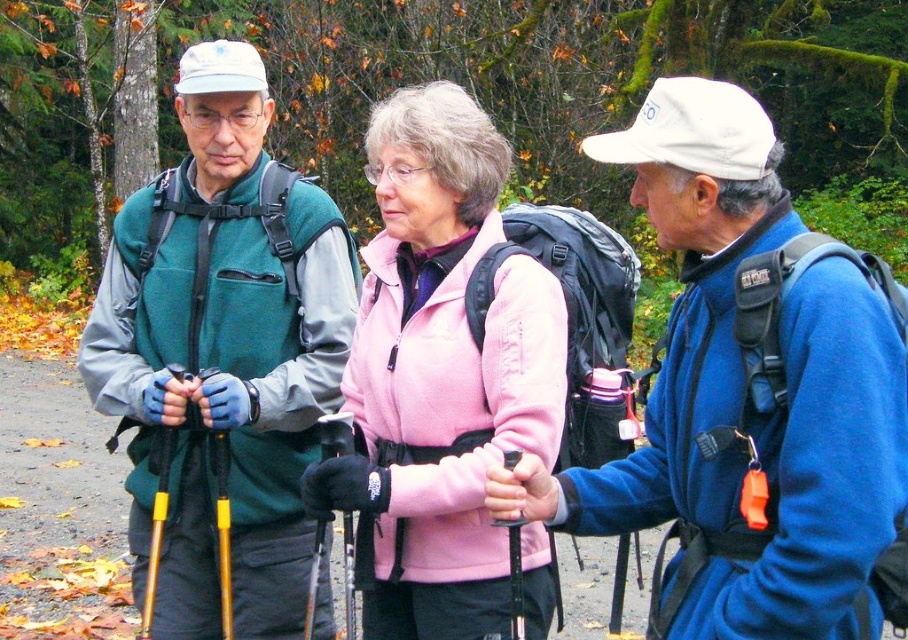
You are a photographer standing in front of the three hikers. You want to take a photo that includes both points marked as point (141, 461) and point (544, 536). Which point should you focus on first to ensure both are in focus?

You should focus on point (141, 461) first because it is closer to the camera than point (544, 536). By focusing on the closer point, the farther point will also be within the depth of field and in focus.

You are a photographer trying to capture a photo of the blue fleece jacket at center and the matte green vest at left. Which one will appear closer to the camera in the photo?

The blue fleece jacket at center appears closer to the camera because it is positioned under the matte green vest at left, indicating it is in front of the vest.